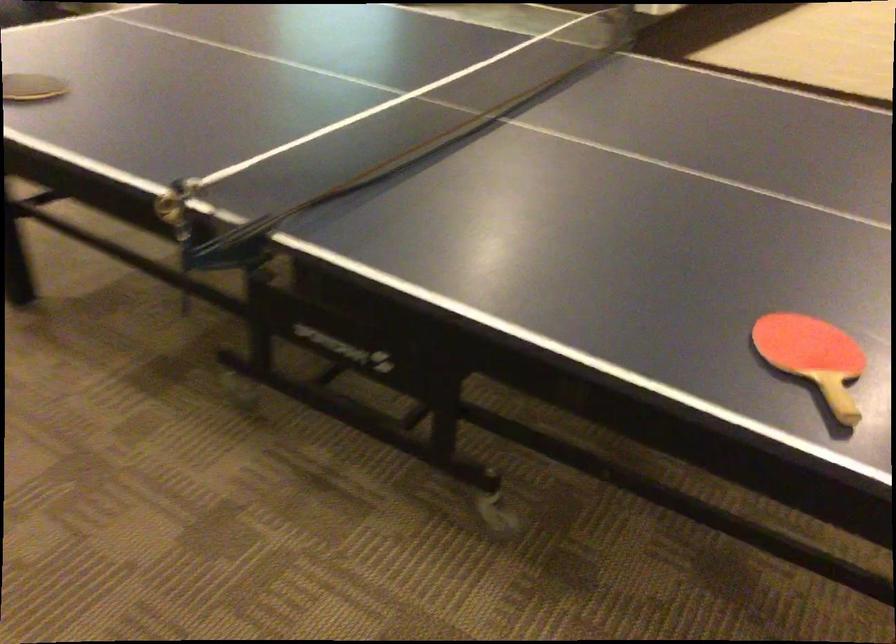
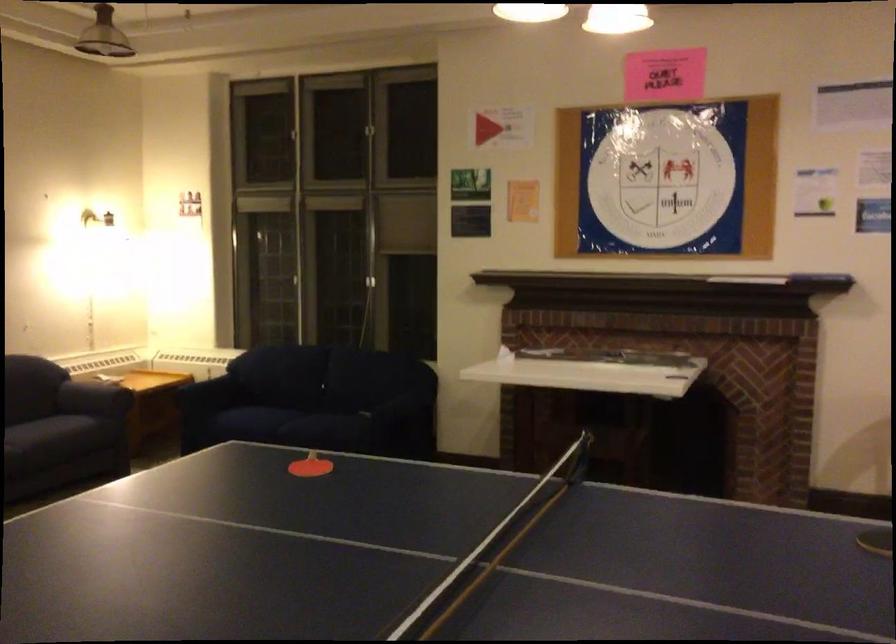
Question: I am providing you with two images of the same scene from different viewpoints. After the viewpoint changes to image2, which objects are now occluded?

Choices:
 (A) dark sofa armrest
 (B) net clamp screw
 (C) pair of brown shoes
 (D) blue sofa armrest

Answer: (B)